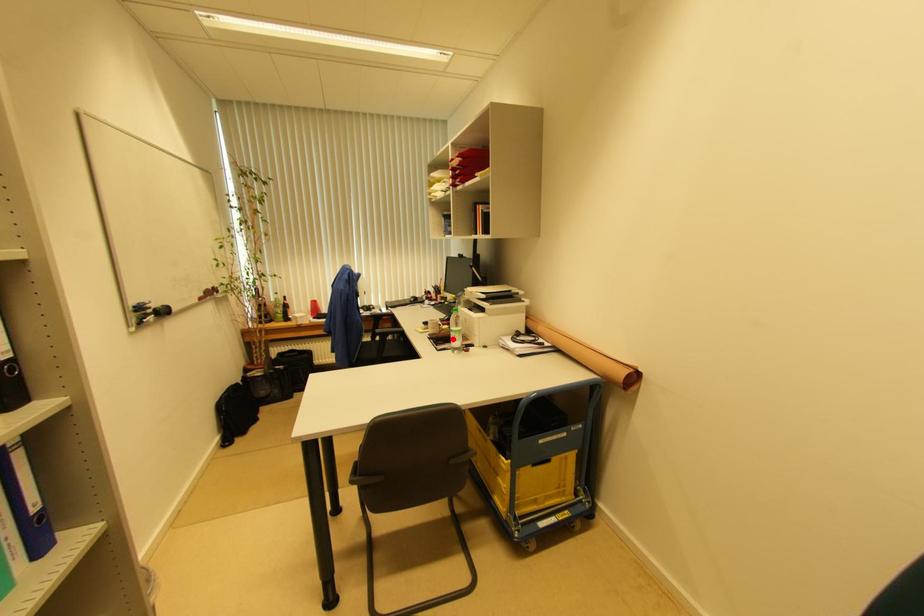
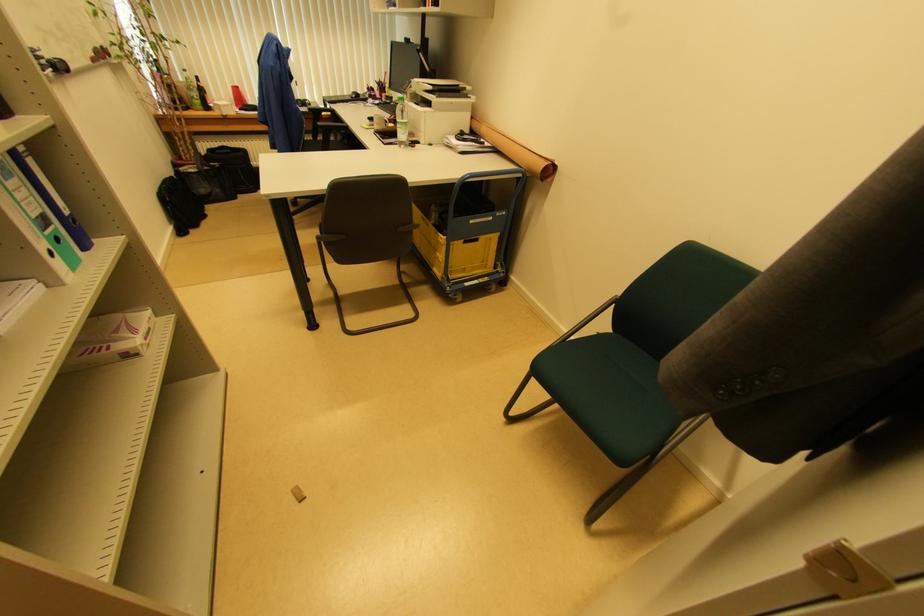
In the second image, find the point that corresponds to the highlighted location in the first image.

(398, 132)